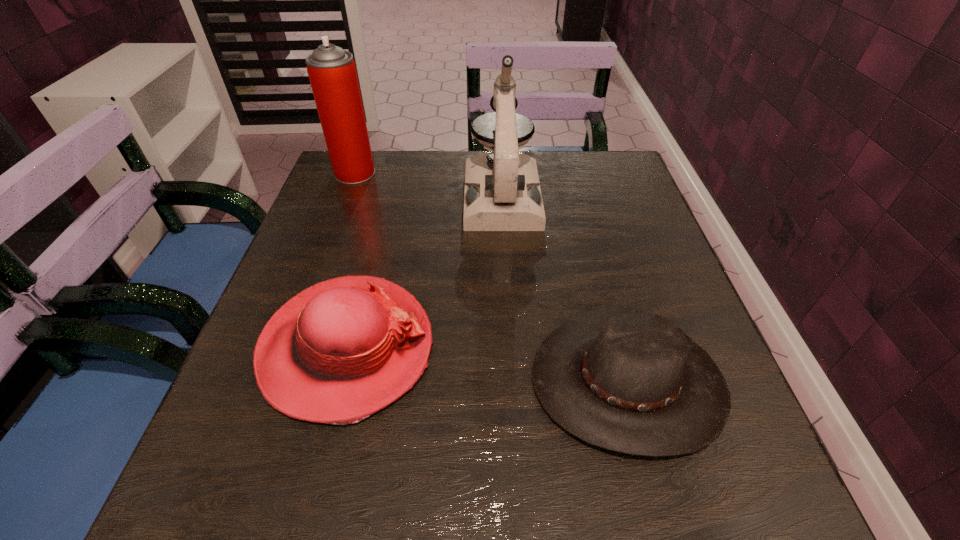
Image resolution: width=960 pixels, height=540 pixels. Identify the location of aerosol can that is at the left edge. (332, 73).

Locate an element on the screen. The height and width of the screenshot is (540, 960). hat that is positioned at the left edge is located at coordinates (339, 351).

Locate an element on the screen. Image resolution: width=960 pixels, height=540 pixels. object at the right edge is located at coordinates (625, 380).

What are the coordinates of `object situated at the far left corner` in the screenshot? It's located at (332, 73).

At what (x,y) coordinates should I click in order to perform the action: click on object located at the near right corner. Please return your answer as a coordinate pair (x, y). The image size is (960, 540). Looking at the image, I should click on (625, 380).

Find the location of a particular element. The height and width of the screenshot is (540, 960). free space at the far edge of the desktop is located at coordinates (414, 150).

Where is `free space at the near edge of the desktop`? The height and width of the screenshot is (540, 960). free space at the near edge of the desktop is located at coordinates (483, 519).

Identify the location of vacant space at the right edge of the desktop. (614, 305).

This screenshot has width=960, height=540. In order to click on free region at the far right corner in this screenshot , I will do `click(621, 171)`.

At what (x,y) coordinates should I click in order to perform the action: click on vacant space at the near right corner of the desktop. Please return your answer as a coordinate pair (x, y). This screenshot has height=540, width=960. Looking at the image, I should click on (668, 499).